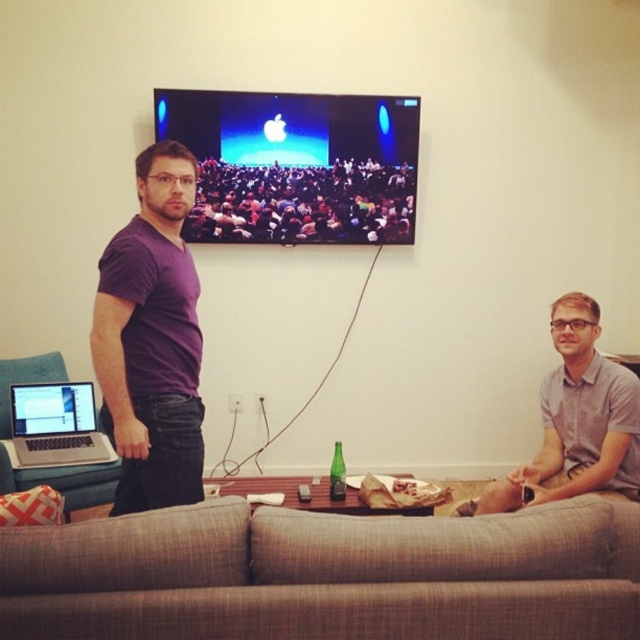
Does purple cotton t-shirt at left have a smaller size compared to matte black crowd at upper center?

Incorrect, purple cotton t-shirt at left is not smaller in size than matte black crowd at upper center.

Does purple cotton t-shirt at left have a greater height compared to matte black crowd at upper center?

Yes, purple cotton t-shirt at left is taller than matte black crowd at upper center.

Does point (186, 419) lie in front of point (355, 234)?

Yes, it is.

Locate an element on the screen. purple cotton t-shirt at left is located at coordinates (150, 339).

Does matte black crowd at upper center have a smaller size compared to matte silver laptop at left?

Actually, matte black crowd at upper center might be larger than matte silver laptop at left.

Which is more to the left, matte black crowd at upper center or matte silver laptop at left?

Positioned to the left is matte silver laptop at left.

Identify the location of matte black crowd at upper center. The height and width of the screenshot is (640, 640). (304, 204).

Consider the image. Can you confirm if textured beige couch at lower center is shorter than purple cotton t-shirt at left?

Yes, textured beige couch at lower center is shorter than purple cotton t-shirt at left.

Between textured beige couch at lower center and purple cotton t-shirt at left, which one appears on the left side from the viewer's perspective?

purple cotton t-shirt at left

Between point (476, 637) and point (193, 321), which one is positioned in front?

Point (476, 637)

Find the location of `textured beige couch at lower center`. textured beige couch at lower center is located at coordinates (324, 576).